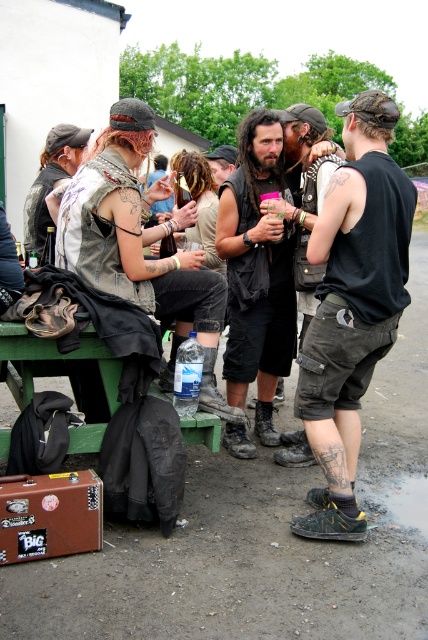
Is black matte cargo shorts at center above matte black vest at center?

Actually, black matte cargo shorts at center is below matte black vest at center.

Does black matte cargo shorts at center have a greater height compared to matte black vest at center?

Correct, black matte cargo shorts at center is much taller as matte black vest at center.

Find the location of `black matte cargo shorts at center`. black matte cargo shorts at center is located at coordinates point(353,305).

Can you confirm if black matte cargo shorts at center is positioned below dark brown leather vest at center?

Yes, black matte cargo shorts at center is below dark brown leather vest at center.

What are the coordinates of `black matte cargo shorts at center` in the screenshot? It's located at (353, 305).

Who is shorter, dark brown leather vest at center or matte black vest at center?

Standing shorter between the two is matte black vest at center.

Which is above, dark brown leather vest at center or matte black vest at center?

matte black vest at center is above.

Is point (276, 374) farther from viewer compared to point (309, 316)?

Yes, point (276, 374) is farther from viewer.

Locate an element on the screen. The image size is (428, 640). dark brown leather vest at center is located at coordinates (256, 272).